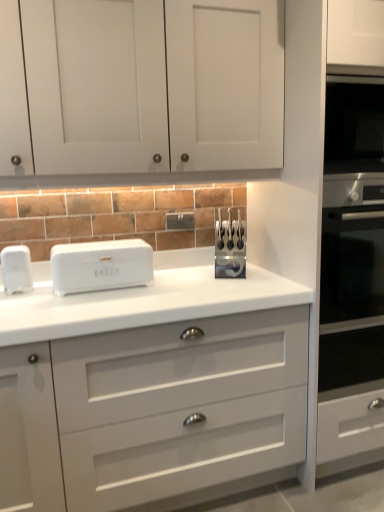
Question: Does point [x=185, y=220] appear closer or farther from the camera than point [x=49, y=402]?

Choices:
 (A) farther
 (B) closer

Answer: (A)

Question: Do you think white plastic electric outlet at center is within white glossy chest of drawers at center, or outside of it?

Choices:
 (A) inside
 (B) outside

Answer: (B)

Question: Which object is the closest to the white glossy bread bin at center, placed as the second home appliance when sorted from left to right?

Choices:
 (A) white matte cabinet doors at upper center
 (B) white plastic electric outlet at center
 (C) white plastic bread bin at left, which appears as the first home appliance when viewed from the left
 (D) white glossy chest of drawers at center

Answer: (C)

Question: Estimate the real-world distances between objects in this image. Which object is farther from the white plastic bread bin at left, arranged as the 2th home appliance when viewed from the right?

Choices:
 (A) white glossy chest of drawers at center
 (B) white plastic electric outlet at center
 (C) white matte cabinet doors at upper center
 (D) white glossy bread bin at center, placed as the second home appliance when sorted from left to right

Answer: (C)